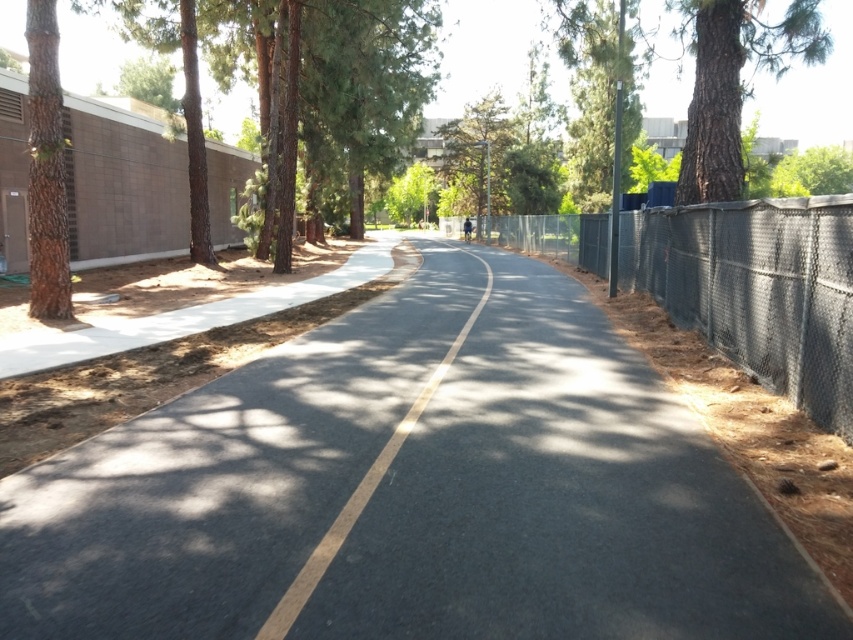
Question: Does chain-link fence at right appear over brown rough bark tree at left?

Choices:
 (A) no
 (B) yes

Answer: (A)

Question: Observing the image, what is the correct spatial positioning of asphalt at center in reference to chain-link fence at right?

Choices:
 (A) below
 (B) above

Answer: (A)

Question: Which of the following is the closest to the observer?

Choices:
 (A) chain-link fence at right
 (B) green leafy tree at center

Answer: (A)

Question: Among these objects, which one is farthest from the camera?

Choices:
 (A) black asphalt road at center
 (B) brown rough bark tree at left
 (C) asphalt at center

Answer: (B)

Question: Which object appears closest to the camera in this image?

Choices:
 (A) green leafy tree at center
 (B) black asphalt road at center

Answer: (B)

Question: Does brown rough bark tree at left appear under green leafy tree at center?

Choices:
 (A) no
 (B) yes

Answer: (B)